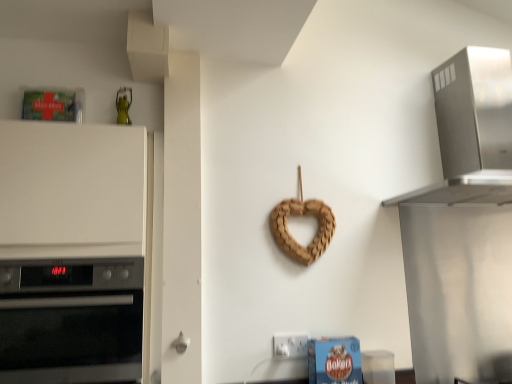
Question: Considering the positions of stainless steel range hood at upper right and white plastic electric outlet at lower center in the image, is stainless steel range hood at upper right bigger or smaller than white plastic electric outlet at lower center?

Choices:
 (A) small
 (B) big

Answer: (B)

Question: From the image's perspective, is stainless steel range hood at upper right located above or below white plastic electric outlet at lower center?

Choices:
 (A) above
 (B) below

Answer: (A)

Question: Considering the real-world distances, which object is farthest from the white plastic electric outlet at lower center?

Choices:
 (A) braided wood heart at center
 (B) stainless steel range hood at upper right
 (C) black glass oven at left
 (D) white matte oven at left
 (E) white plastic door handle at lower center

Answer: (B)

Question: Which is farther from the black glass oven at left?

Choices:
 (A) stainless steel range hood at upper right
 (B) braided wood heart at center
 (C) white plastic electric outlet at lower center
 (D) white plastic door handle at lower center
 (E) white matte oven at left

Answer: (A)